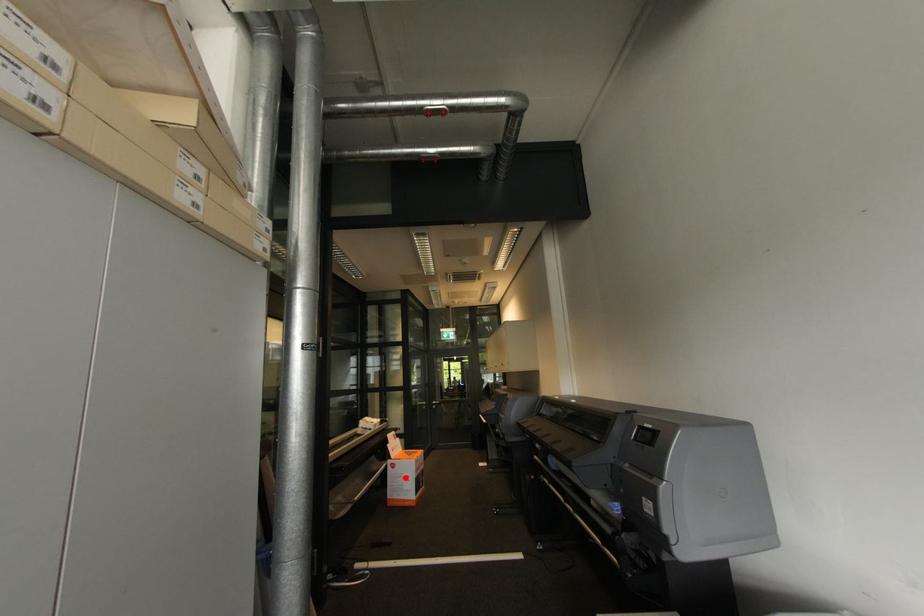
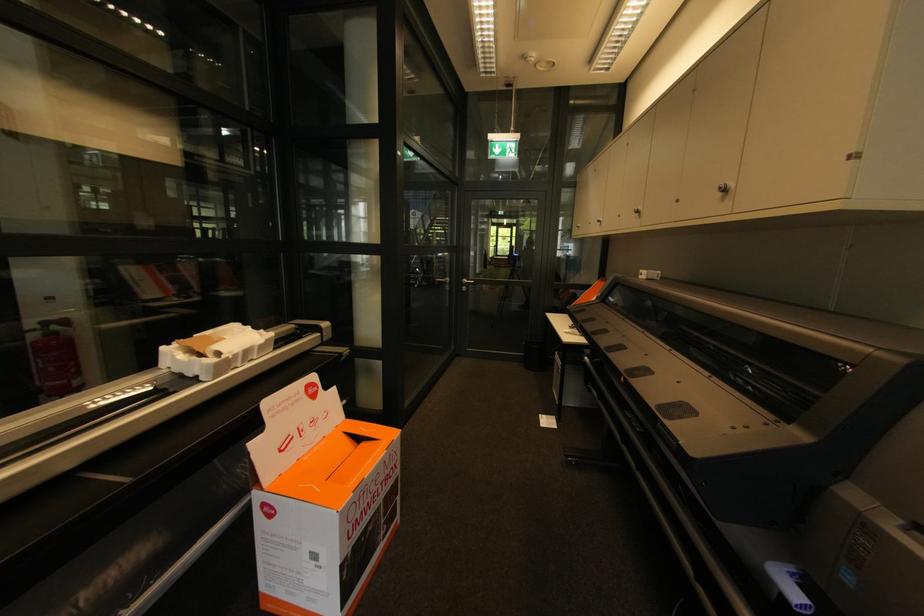
Question: I am providing you with two images of the same scene from different viewpoints. Image1 has a red point marked. In image2, the corresponding 3D location appears at what relative position? Reply with the corresponding letter.

Choices:
 (A) Closer
 (B) Farther

Answer: (A)